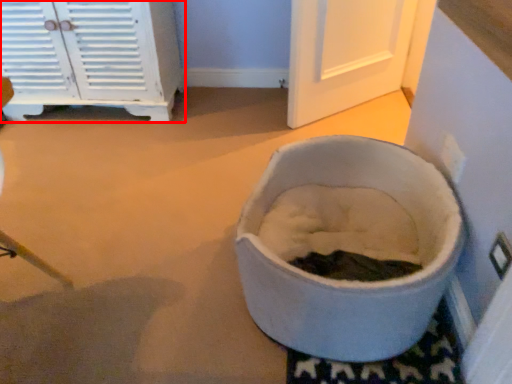
Question: Observing the image, what is the correct spatial positioning of cabinetry (annotated by the red box) in reference to toilet?

Choices:
 (A) right
 (B) left

Answer: (B)